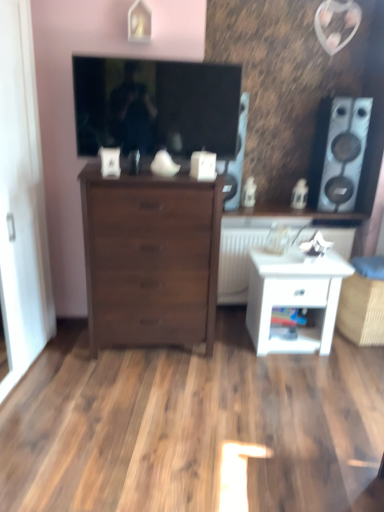
Find the location of a particular element. This screenshot has width=384, height=512. free spot in front of dark wood chest of drawers at center is located at coordinates (139, 392).